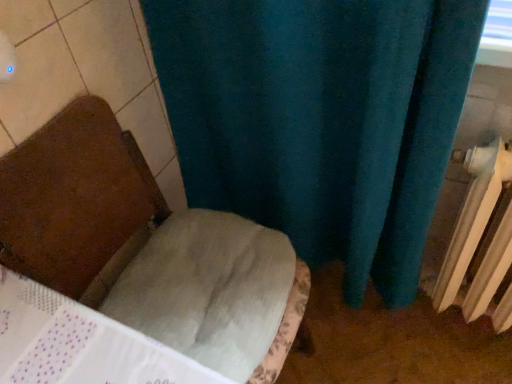
Question: Does white plastic radiator at right have a smaller size compared to white fabric chair at center?

Choices:
 (A) yes
 (B) no

Answer: (A)

Question: Does white plastic radiator at right appear on the right side of white fabric chair at center?

Choices:
 (A) yes
 (B) no

Answer: (A)

Question: Considering the relative sizes of white plastic radiator at right and white fabric chair at center in the image provided, is white plastic radiator at right wider than white fabric chair at center?

Choices:
 (A) yes
 (B) no

Answer: (B)

Question: Is white plastic radiator at right at the left side of white fabric chair at center?

Choices:
 (A) no
 (B) yes

Answer: (A)

Question: Does white plastic radiator at right contain white fabric chair at center?

Choices:
 (A) yes
 (B) no

Answer: (B)

Question: Is the depth of white plastic radiator at right less than that of white fabric chair at center?

Choices:
 (A) no
 (B) yes

Answer: (A)

Question: Considering the relative sizes of white fabric chair at center and white plastic radiator at right in the image provided, is white fabric chair at center taller than white plastic radiator at right?

Choices:
 (A) no
 (B) yes

Answer: (B)

Question: Does white fabric chair at center turn towards white plastic radiator at right?

Choices:
 (A) yes
 (B) no

Answer: (B)

Question: From the image's perspective, is white fabric chair at center over white plastic radiator at right?

Choices:
 (A) yes
 (B) no

Answer: (B)

Question: Is white fabric chair at center thinner than white plastic radiator at right?

Choices:
 (A) no
 (B) yes

Answer: (A)

Question: Can you confirm if white fabric chair at center is shorter than white plastic radiator at right?

Choices:
 (A) yes
 (B) no

Answer: (B)

Question: Is white fabric chair at center to the left of white plastic radiator at right from the viewer's perspective?

Choices:
 (A) yes
 (B) no

Answer: (A)

Question: Is point (49, 241) positioned closer to the camera than point (471, 286)?

Choices:
 (A) closer
 (B) farther

Answer: (A)